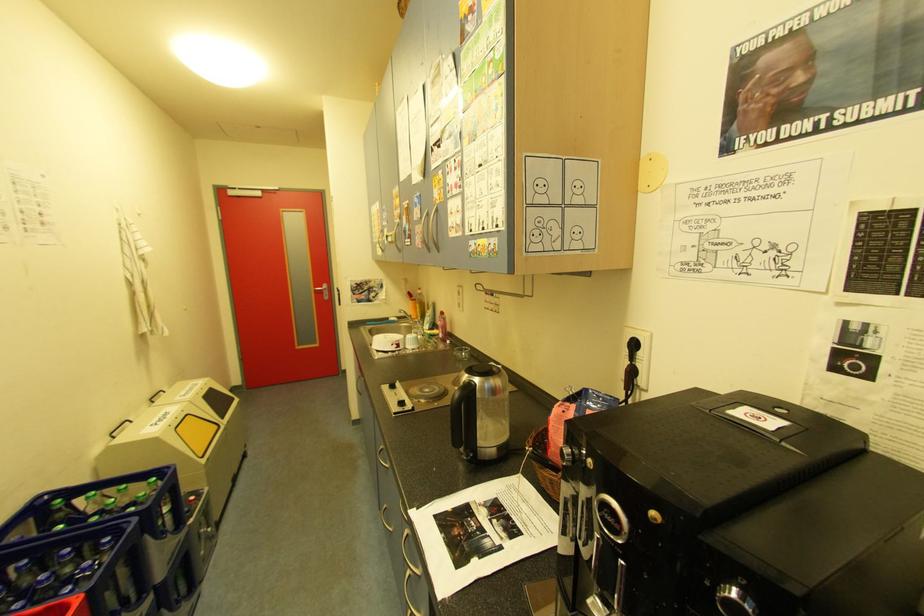
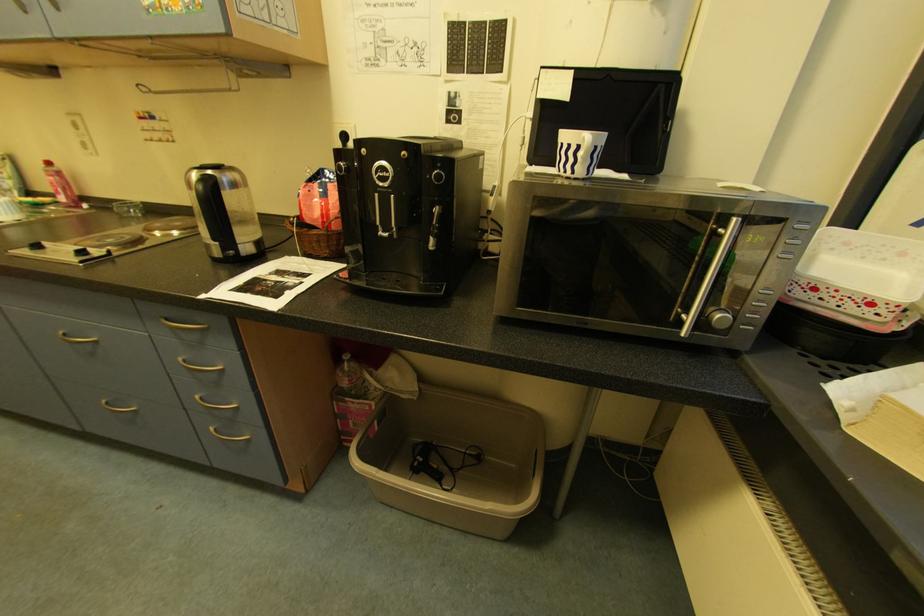
The first image is from the beginning of the video and the second image is from the end. How did the camera likely rotate when shooting the video?

The rotation direction of the camera is right-down.